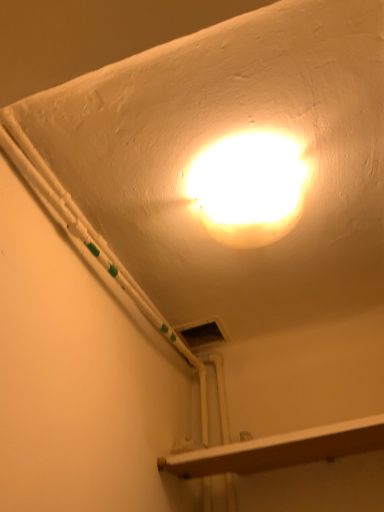
Question: Is white glossy light fixture at upper center positioned with its back to wooden at lower right?

Choices:
 (A) yes
 (B) no

Answer: (B)

Question: Would you say white glossy light fixture at upper center is outside wooden at lower right?

Choices:
 (A) yes
 (B) no

Answer: (A)

Question: Are white glossy light fixture at upper center and wooden at lower right far apart?

Choices:
 (A) no
 (B) yes

Answer: (A)

Question: Is wooden at lower right surrounded by white glossy light fixture at upper center?

Choices:
 (A) no
 (B) yes

Answer: (A)

Question: Does white glossy light fixture at upper center appear on the left side of wooden at lower right?

Choices:
 (A) no
 (B) yes

Answer: (B)

Question: From the image's perspective, would you say white glossy light fixture at upper center is positioned over wooden at lower right?

Choices:
 (A) no
 (B) yes

Answer: (B)

Question: From a real-world perspective, is wooden at lower right on top of white glossy light fixture at upper center?

Choices:
 (A) yes
 (B) no

Answer: (B)

Question: Is white glossy light fixture at upper center located within wooden at lower right?

Choices:
 (A) no
 (B) yes

Answer: (A)

Question: Is wooden at lower right at the left side of white glossy light fixture at upper center?

Choices:
 (A) yes
 (B) no

Answer: (B)

Question: Considering the relative sizes of wooden at lower right and white glossy light fixture at upper center in the image provided, is wooden at lower right thinner than white glossy light fixture at upper center?

Choices:
 (A) yes
 (B) no

Answer: (B)

Question: Is wooden at lower right positioned beyond the bounds of white glossy light fixture at upper center?

Choices:
 (A) no
 (B) yes

Answer: (B)

Question: Are wooden at lower right and white glossy light fixture at upper center beside each other?

Choices:
 (A) yes
 (B) no

Answer: (B)

Question: Would you say white glossy light fixture at upper center is inside or outside wooden at lower right?

Choices:
 (A) outside
 (B) inside

Answer: (A)